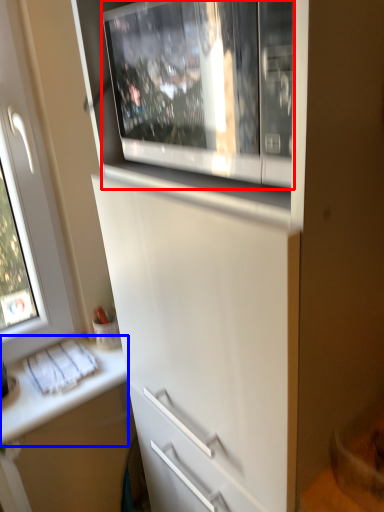
Question: Which object appears closest to the camera in this image, home appliance (highlighted by a red box) or counter top (highlighted by a blue box)?

Choices:
 (A) home appliance
 (B) counter top

Answer: (A)